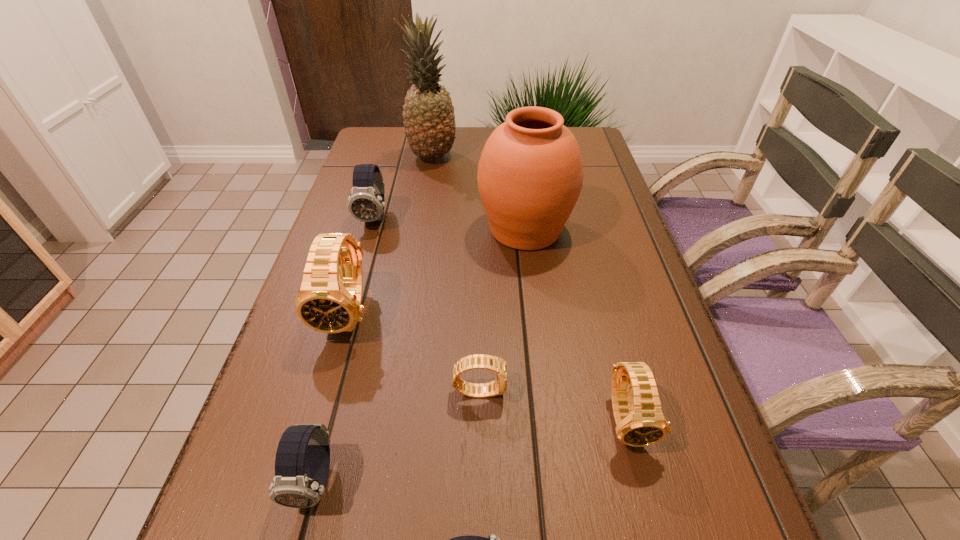
Locate an element on the screen. watch that is at the right edge is located at coordinates (640, 422).

Locate an element on the screen. The height and width of the screenshot is (540, 960). object located in the far left corner section of the desktop is located at coordinates (429, 120).

Where is `free point at the far edge`? This screenshot has width=960, height=540. free point at the far edge is located at coordinates (481, 139).

Image resolution: width=960 pixels, height=540 pixels. In order to click on vacant area at the left edge in this screenshot , I will do `click(401, 181)`.

In the image, there is a desktop. Identify the location of vacant space at the right edge. (580, 268).

Locate an element on the screen. This screenshot has width=960, height=540. free space at the far left corner of the desktop is located at coordinates (394, 132).

In the image, there is a desktop. Find the location of `vacant space at the far right corner`. vacant space at the far right corner is located at coordinates (602, 159).

Find the location of `free point between the farthest black watch and the second nearest dark watch`. free point between the farthest black watch and the second nearest dark watch is located at coordinates (333, 396).

In order to click on free area in between the farthest dark watch and the farthest black watch in this screenshot , I will do [x=362, y=266].

The image size is (960, 540). What are the coordinates of `free spot between the smallest black watch and the urn` in the screenshot? It's located at (502, 309).